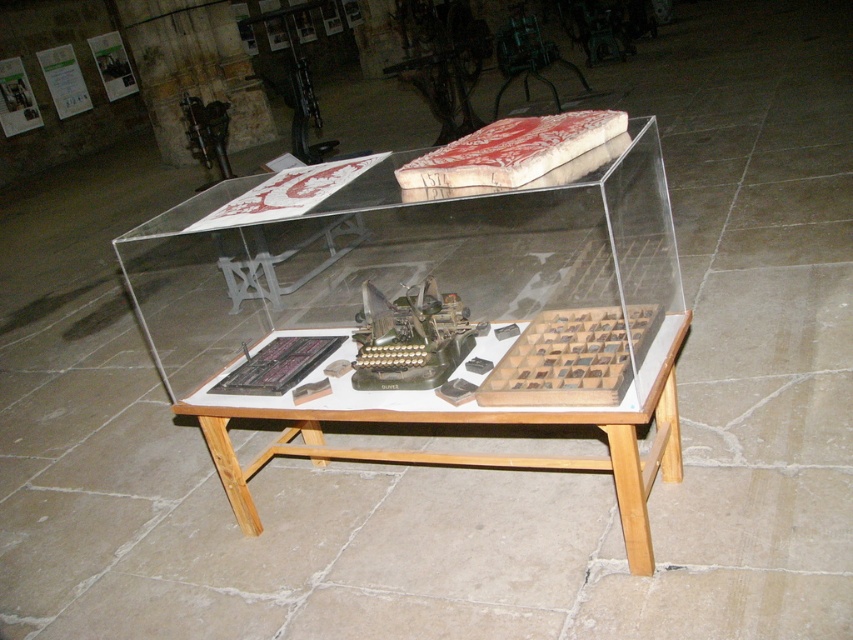
Question: Which object is closer to the camera taking this photo?

Choices:
 (A) transparent acrylic box at center
 (B) wooden table at center

Answer: (B)

Question: Can you confirm if transparent acrylic box at center is positioned to the right of wooden table at center?

Choices:
 (A) no
 (B) yes

Answer: (A)

Question: Can you confirm if transparent acrylic box at center is thinner than wooden table at center?

Choices:
 (A) no
 (B) yes

Answer: (A)

Question: Which of the following is the farthest from the observer?

Choices:
 (A) wooden table at center
 (B) transparent acrylic box at center

Answer: (B)

Question: Can you confirm if transparent acrylic box at center is positioned to the right of wooden table at center?

Choices:
 (A) yes
 (B) no

Answer: (B)